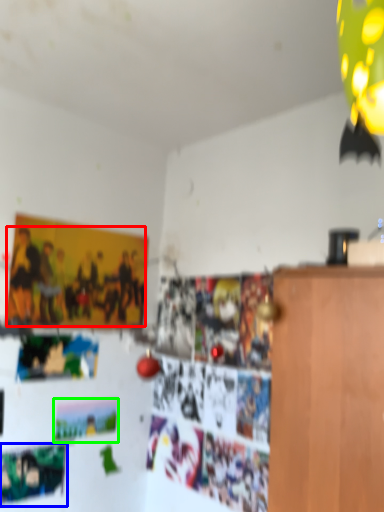
Question: Which is nearer to the person (highlighted by a red box)? poster (highlighted by a blue box) or postcard (highlighted by a green box).

Choices:
 (A) poster
 (B) postcard

Answer: (B)